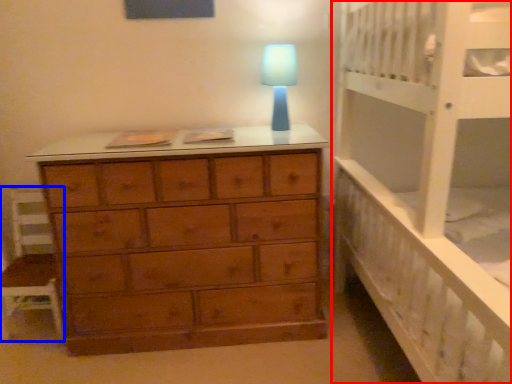
Question: Among these objects, which one is farthest to the camera, bed (highlighted by a red box) or chair (highlighted by a blue box)?

Choices:
 (A) bed
 (B) chair

Answer: (B)